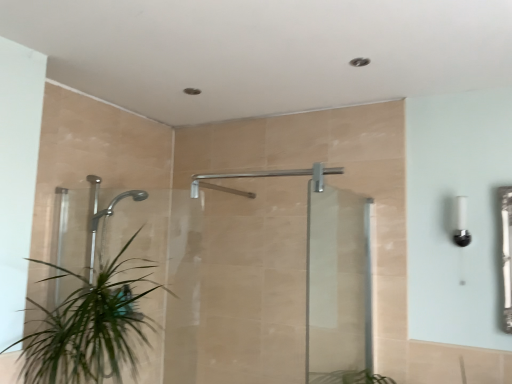
Question: Is green leafy plant at lower left inside the boundaries of silver metallic shower at center, or outside?

Choices:
 (A) inside
 (B) outside

Answer: (B)

Question: From a real-world perspective, is green leafy plant at lower left positioned above or below silver metallic shower at center?

Choices:
 (A) below
 (B) above

Answer: (A)

Question: Which is farther from the transparent glass screen door at center, arranged as the first screen door when viewed from the right?

Choices:
 (A) green leafy plant at lower left
 (B) white glossy light fixture at right
 (C) silver metallic shower at center
 (D) transparent glass shower door at center, the first screen door from the left

Answer: (A)

Question: Based on their relative distances, which object is nearer to the silver metallic shower at center?

Choices:
 (A) transparent glass screen door at center, arranged as the first screen door when viewed from the right
 (B) green leafy plant at lower left
 (C) white glossy light fixture at right
 (D) transparent glass shower door at center, which ranks as the 2th screen door in right-to-left order

Answer: (D)